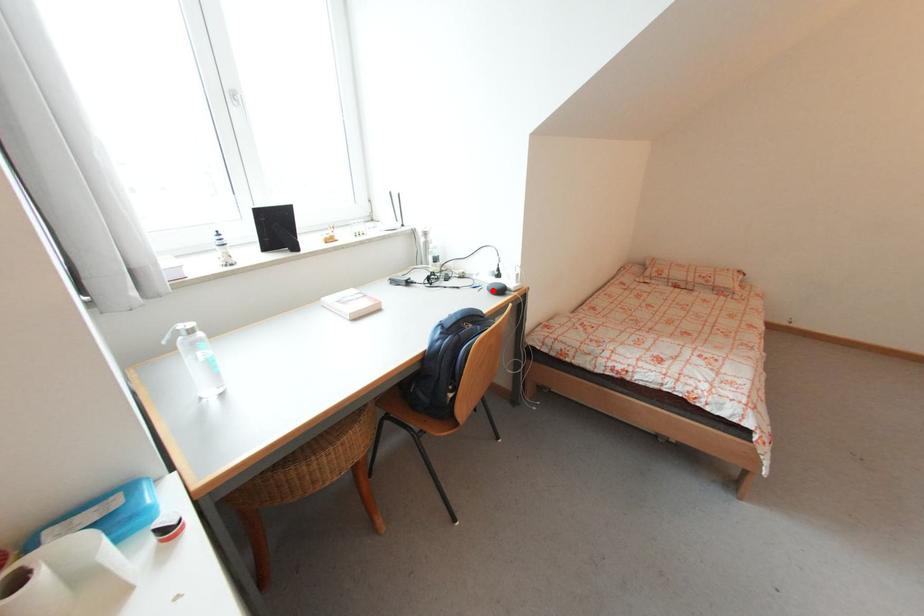
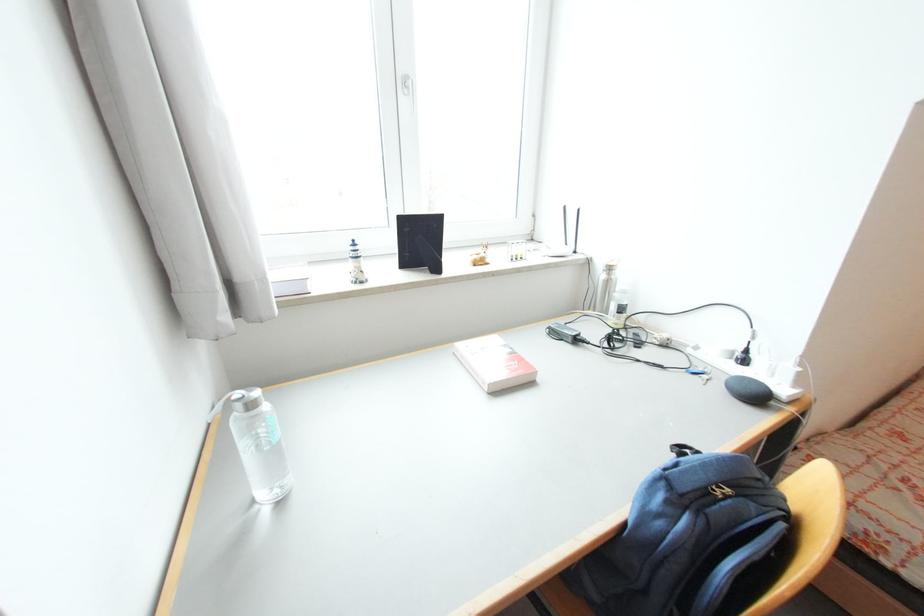
In the second image, find the point that corresponds to the highlighted location in the first image.

(734, 387)